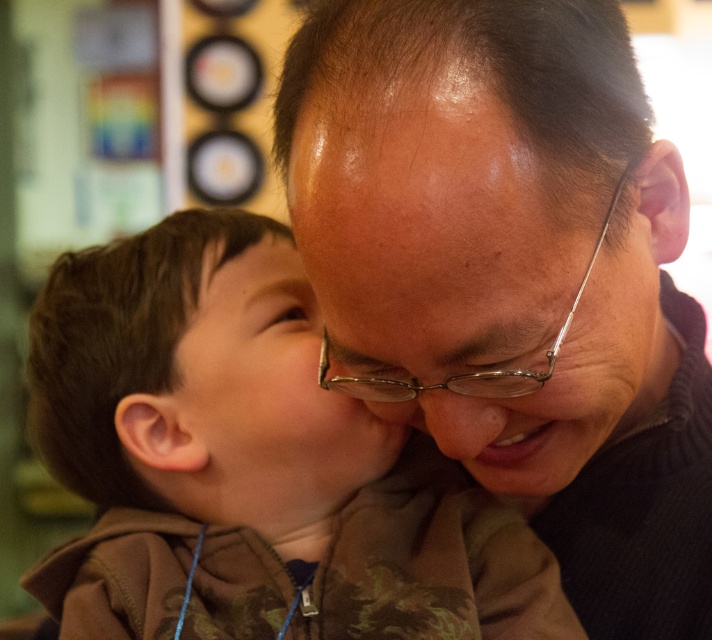
Describe the element at coordinates (248, 461) in the screenshot. I see `brown camouflage hoodie at center` at that location.

Find the location of a particular element. brown camouflage hoodie at center is located at coordinates (x=248, y=461).

Measure the distance between matte brown sweater at center and camera.

They are 18.59 inches apart.

Can you confirm if matte brown sweater at center is positioned above brown camouflage hoodie at center?

Indeed, matte brown sweater at center is positioned over brown camouflage hoodie at center.

Which is behind, point (459, 88) or point (201, 484)?

The point (201, 484) is more distant.

Identify the location of matte brown sweater at center. This screenshot has height=640, width=712. (515, 269).

Is clear plastic glasses at center further to camera compared to matte skin nose at center?

No, it is in front of matte skin nose at center.

Which of these two, clear plastic glasses at center or matte skin nose at center, stands taller?

With more height is clear plastic glasses at center.

Describe the element at coordinates (471, 371) in the screenshot. I see `clear plastic glasses at center` at that location.

Image resolution: width=712 pixels, height=640 pixels. Identify the location of clear plastic glasses at center. (471, 371).